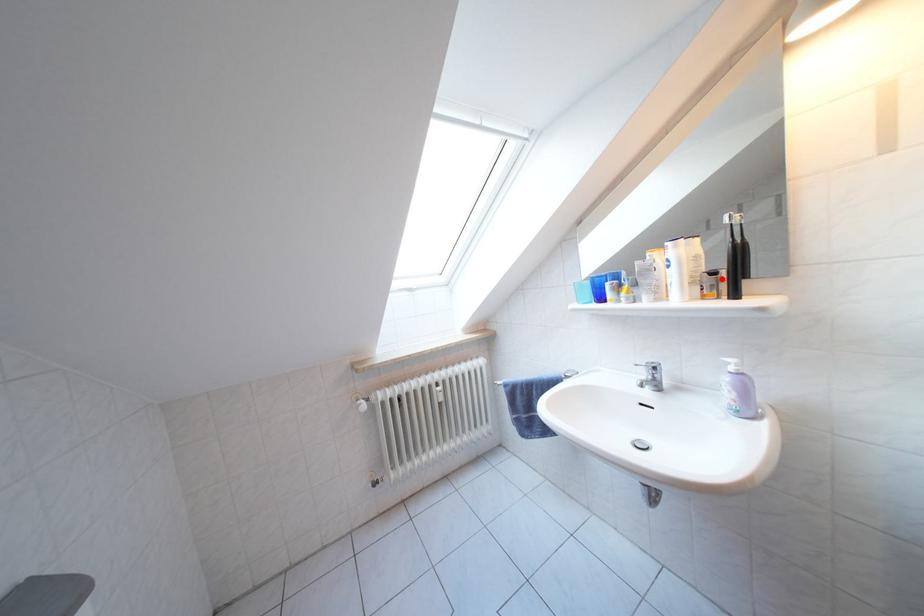
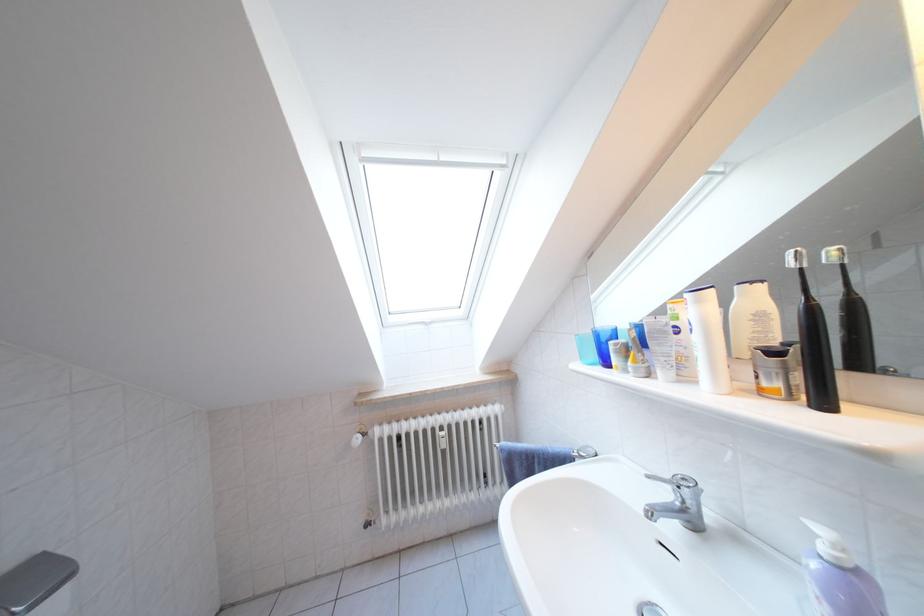
Where in the second image is the point corresponding to the highlighted location from the first image?

(783, 359)